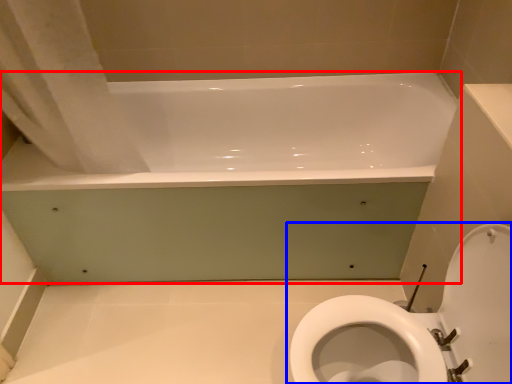
Question: Which object appears closest to the camera in this image, bathtub (highlighted by a red box) or toilet (highlighted by a blue box)?

Choices:
 (A) bathtub
 (B) toilet

Answer: (B)